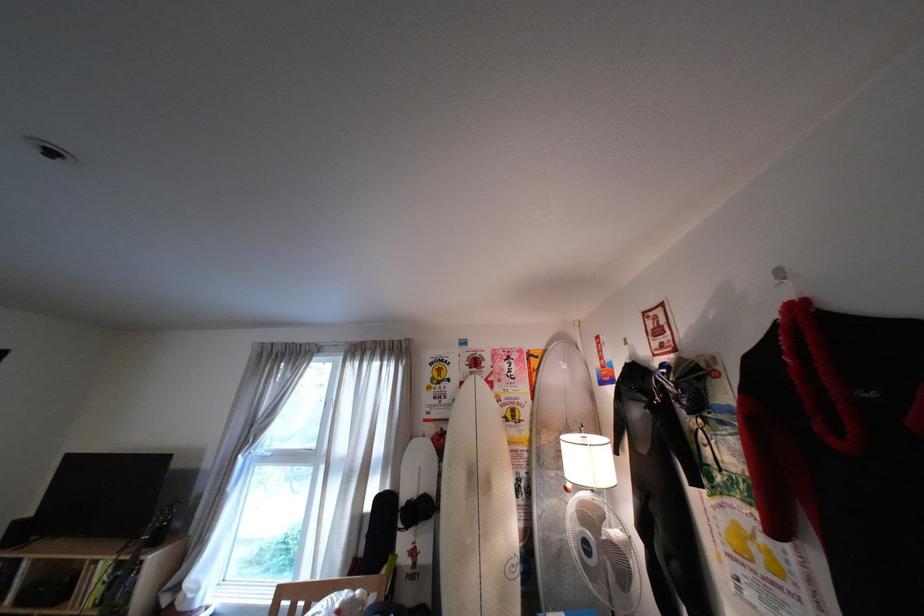
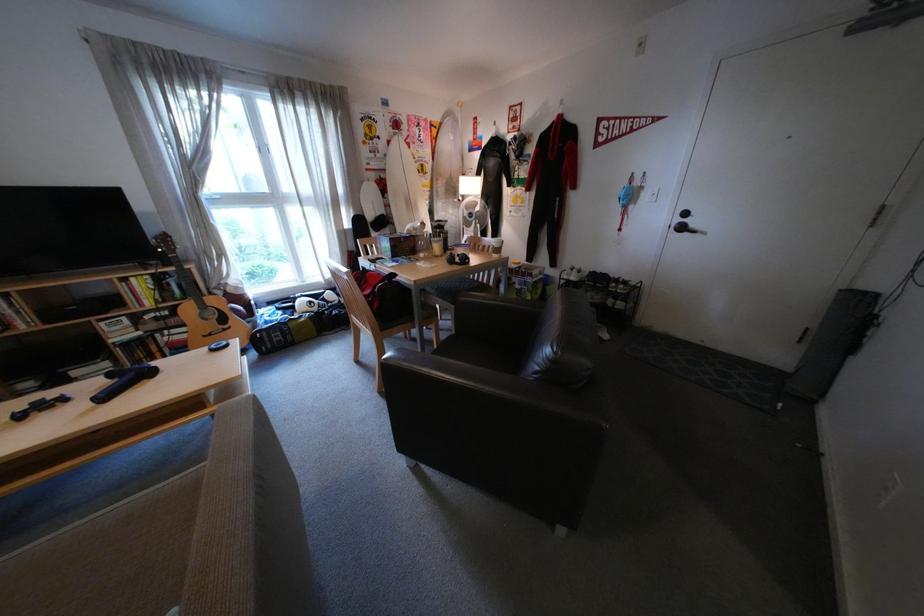
The point at (x=457, y=402) is marked in the first image. Where is the corresponding point in the second image?

(392, 156)